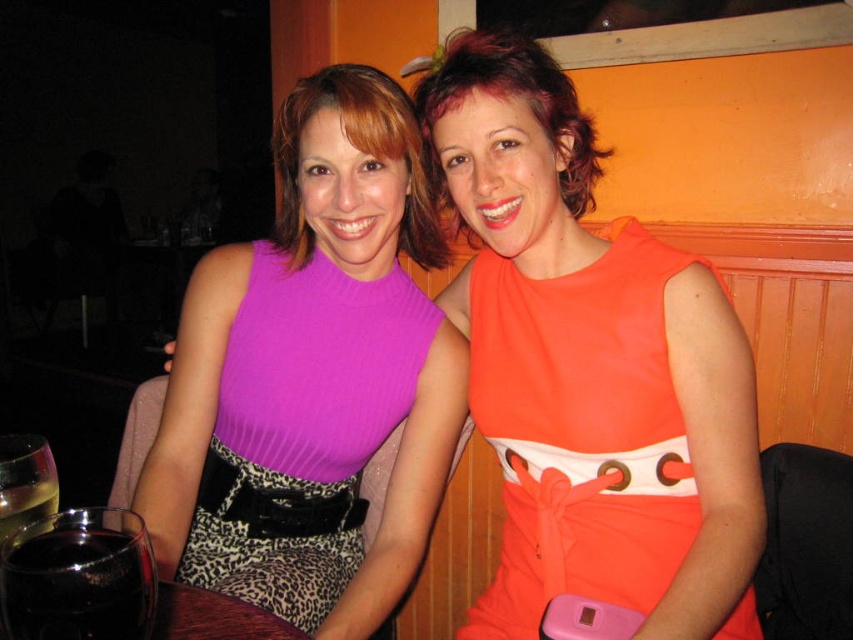
You are a server at a restaurant and need to place a 12 inch wide dessert plate between the orange satin dress at center and the translucent glass wine at lower left. Is there enough space?

The orange satin dress at center and the translucent glass wine at lower left are 24.50 inches apart, so yes, there is enough space to place a 12 inch wide dessert plate between them since 24.50 inches is greater than 12 inches.

You are a waiter at a restaurant and need to place a dessert menu on the table. The purple ribbed fabric dress at center is currently blocking the area where you want to place it. Can you move the dessert menu to the left of the translucent glass wine at lower left without moving the dress?

The purple ribbed fabric dress at center is to the right of the translucent glass wine at lower left, so placing the dessert menu to the left of the wine would be possible without moving the dress since the dress is already to the right of the wine.

You are taking a photo of the two women in the image. You want to focus on the point closer to the camera. Which point should you choose between point (666, 548) and point (48, 548)?

You should choose point (666, 548) because it is further to the camera than point (48, 548).